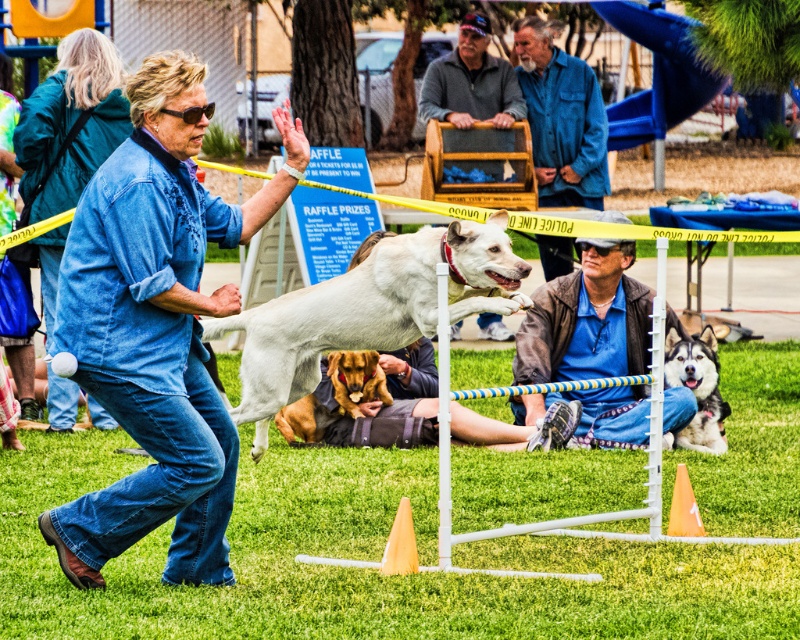
Which is below, white smooth dog at center or shiny brown fur at center?

Positioned lower is shiny brown fur at center.

Which of these two, white smooth dog at center or shiny brown fur at center, stands taller?

With more height is white smooth dog at center.

At what (x,y) coordinates should I click in order to perform the action: click on white smooth dog at center. Please return your answer as a coordinate pair (x, y). This screenshot has height=640, width=800. Looking at the image, I should click on (364, 310).

I want to click on white smooth dog at center, so click(x=364, y=310).

Does white smooth dog at center have a lesser height compared to denim jacket at center?

Yes.

The height and width of the screenshot is (640, 800). In order to click on white smooth dog at center in this screenshot , I will do `click(364, 310)`.

Where is `white smooth dog at center`? Image resolution: width=800 pixels, height=640 pixels. white smooth dog at center is located at coordinates (364, 310).

Does denim jacket at upper left have a greater width compared to silky black fur at center?

Correct, the width of denim jacket at upper left exceeds that of silky black fur at center.

Is point (112, 556) positioned in front of point (698, 356)?

Yes, point (112, 556) is closer to viewer.

Which is behind, point (132, 268) or point (694, 365)?

The point (694, 365) is behind.

Identify the location of denim jacket at upper left. The image size is (800, 640). (156, 328).